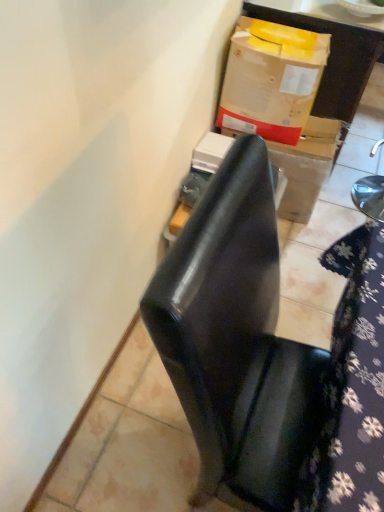
Question: From a real-world perspective, is cardboard box at upper right above or below cardboard box at upper right?

Choices:
 (A) below
 (B) above

Answer: (A)

Question: Is cardboard box at upper right taller or shorter than cardboard box at upper right?

Choices:
 (A) short
 (B) tall

Answer: (A)

Question: Estimate the real-world distances between objects in this image. Which object is closer to the cardboard box at upper right?

Choices:
 (A) cardboard box at upper right
 (B) matte cardboard box at upper right
 (C) floral fabric at lower right
 (D) glossy black chair at center

Answer: (A)

Question: Which is nearer to the glossy black chair at center?

Choices:
 (A) cardboard box at upper right
 (B) floral fabric at lower right
 (C) matte cardboard box at upper right
 (D) cardboard box at upper right

Answer: (B)